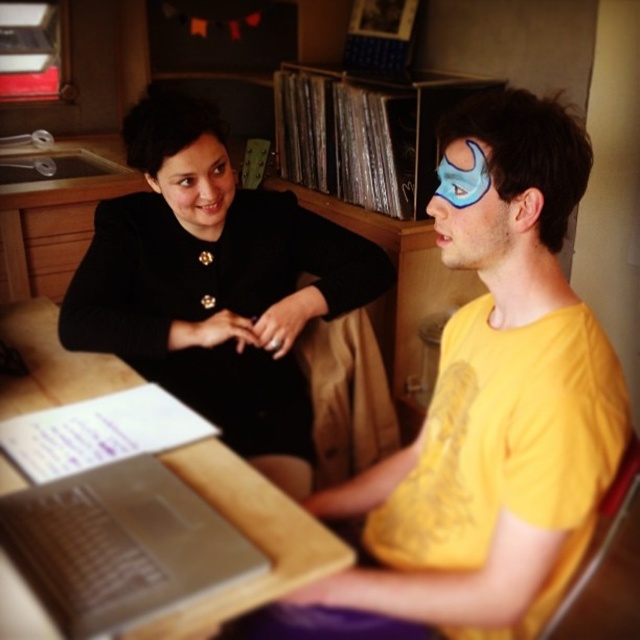
Can you confirm if yellow matte/yellow t-shirt at right is positioned below silver metallic table at center?

No.

Is yellow matte/yellow t-shirt at right to the left of silver metallic table at center from the viewer's perspective?

No, yellow matte/yellow t-shirt at right is not to the left of silver metallic table at center.

Which is behind, point (564, 156) or point (294, 522)?

The point (294, 522) is behind.

Where is `yellow matte/yellow t-shirt at right`? Image resolution: width=640 pixels, height=640 pixels. yellow matte/yellow t-shirt at right is located at coordinates (497, 403).

Which is behind, point (266, 540) or point (449, 196)?

The point (266, 540) is behind.

Measure the distance from silver metallic table at center to blue matte face paint at upper right.

A distance of 38.93 inches exists between silver metallic table at center and blue matte face paint at upper right.

At what (x,y) coordinates should I click in order to perform the action: click on silver metallic table at center. Please return your answer as a coordinate pair (x, y). Looking at the image, I should click on (248, 538).

Is black fabric dress at upper left positioned in front of silver metallic laptop at lower left?

No, it is behind silver metallic laptop at lower left.

Where is `black fabric dress at upper left`? black fabric dress at upper left is located at coordinates (218, 288).

You are a GUI agent. You are given a task and a screenshot of the screen. Output one action in this format:
    pyautogui.click(x=<x>, y=<y>)
    Task: Click on the black fabric dress at upper left
    This screenshot has height=640, width=640.
    Given the screenshot: What is the action you would take?
    pyautogui.click(x=218, y=288)